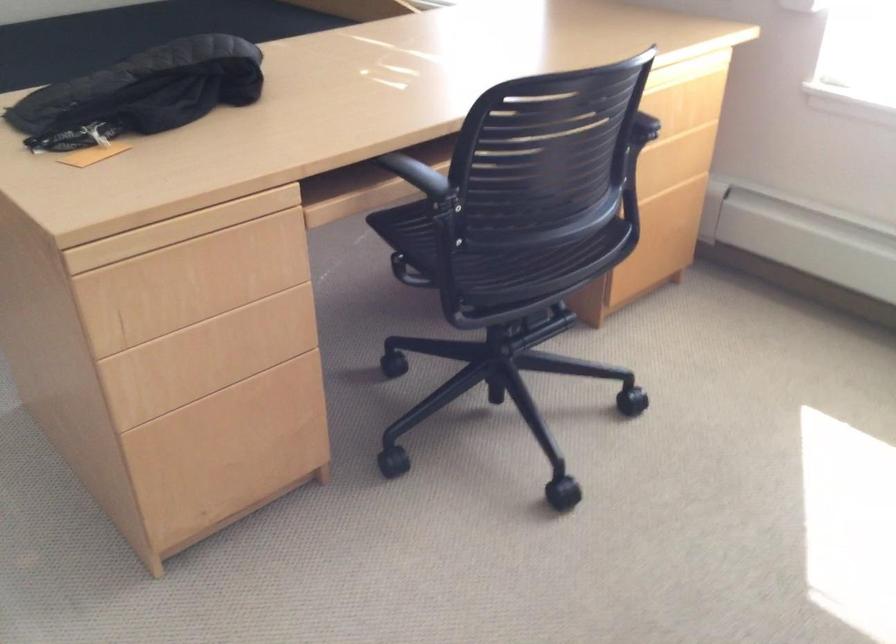
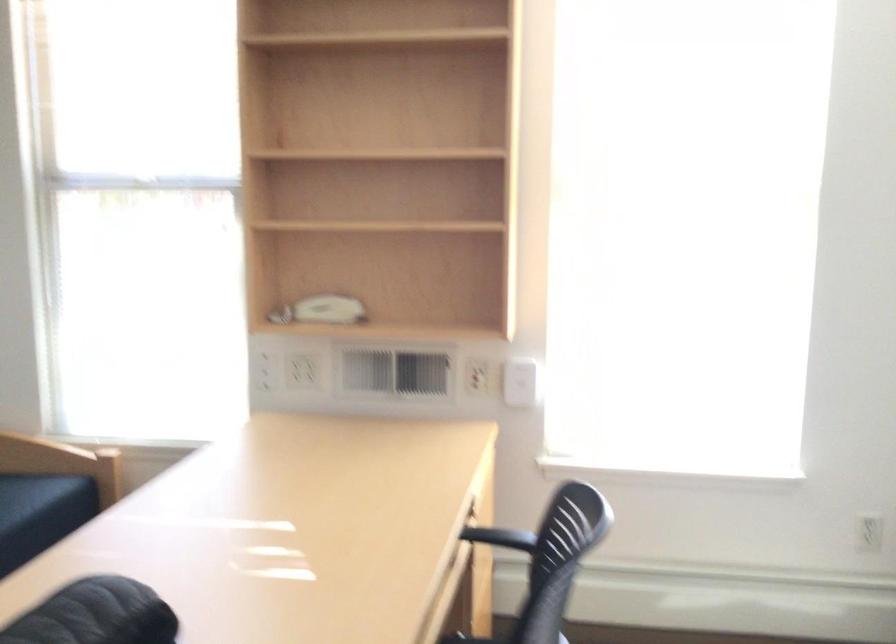
The images are taken continuously from a first-person perspective. In which direction is your viewpoint rotating?

The rotation direction of the camera is right-up.